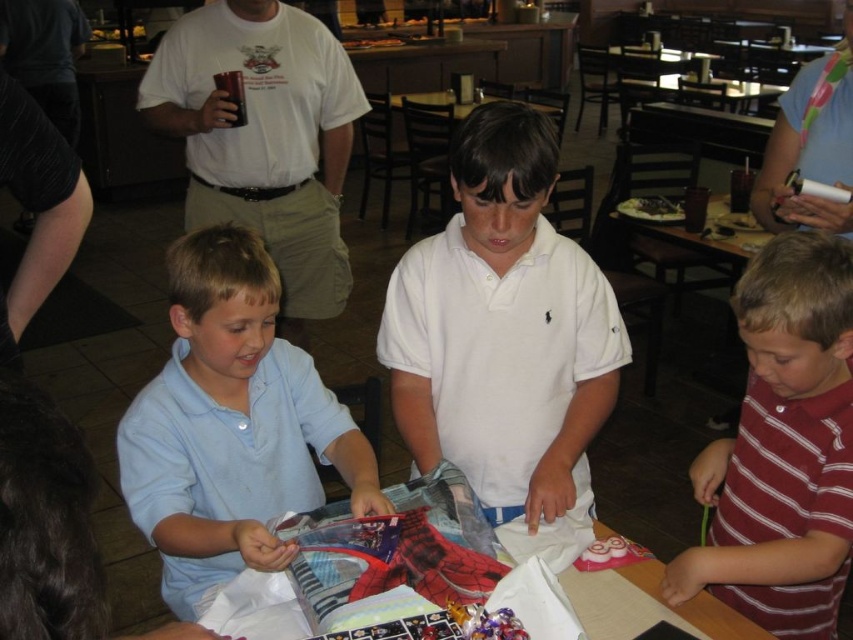
Can you confirm if pink fabric scarf at upper right is bigger than shiny plastic table at center?

Indeed, pink fabric scarf at upper right has a larger size compared to shiny plastic table at center.

Between pink fabric scarf at upper right and shiny plastic table at center, which one appears on the right side from the viewer's perspective?

Positioned to the right is pink fabric scarf at upper right.

What do you see at coordinates (808, 150) in the screenshot?
I see `pink fabric scarf at upper right` at bounding box center [808, 150].

I want to click on pink fabric scarf at upper right, so pos(808,150).

Does point (752, 492) come behind point (287, 289)?

No.

At what (x,y) coordinates should I click in order to perform the action: click on striped cotton shirt at lower right. Please return your answer as a coordinate pair (x, y). The width and height of the screenshot is (853, 640). Looking at the image, I should click on (782, 449).

The height and width of the screenshot is (640, 853). What do you see at coordinates (502, 328) in the screenshot?
I see `white cotton shirt at center` at bounding box center [502, 328].

Between point (502, 337) and point (805, 211), which one is positioned in front?

Point (502, 337)

The width and height of the screenshot is (853, 640). Describe the element at coordinates (502, 328) in the screenshot. I see `white cotton shirt at center` at that location.

Find the location of a particular element. This screenshot has width=853, height=640. white cotton shirt at center is located at coordinates (502, 328).